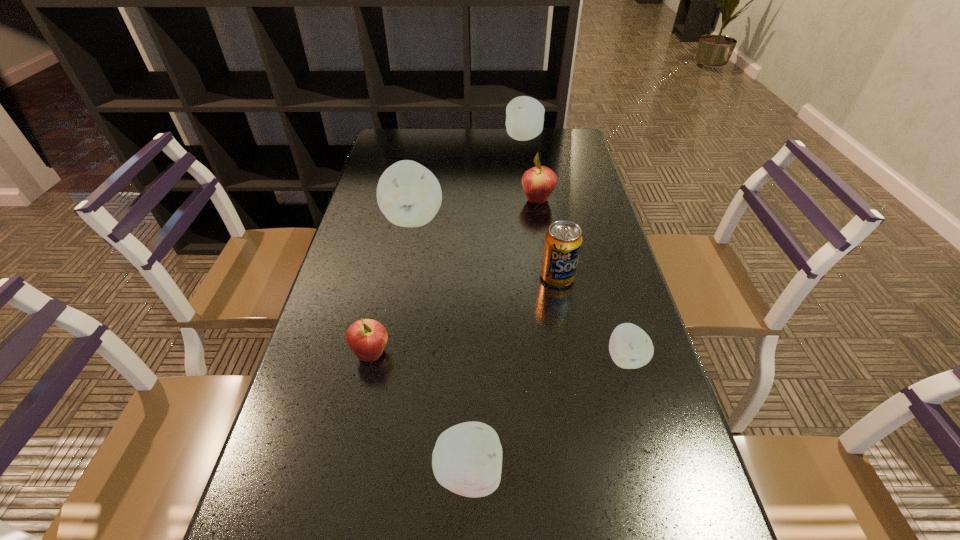
You are a GUI agent. You are given a task and a screenshot of the screen. Output one action in this format:
    pyautogui.click(x=<x>, y=<y>)
    Task: Click on the nearest apple
    This screenshot has height=540, width=960.
    Given the screenshot: What is the action you would take?
    click(467, 458)

Locate an element on the screen. the shortest apple is located at coordinates (630, 347).

This screenshot has width=960, height=540. In order to click on the rightmost white apple in this screenshot , I will do `click(630, 347)`.

What are the coordinates of `free space located 0.260m on the front of the biggest white apple` in the screenshot? It's located at (398, 306).

This screenshot has height=540, width=960. In order to click on vacant region located on the front of the farthest apple in this screenshot , I will do `click(534, 204)`.

Where is `vacant space situated 0.330m on the back of the farther red apple`? The height and width of the screenshot is (540, 960). vacant space situated 0.330m on the back of the farther red apple is located at coordinates (528, 142).

Locate an element on the screen. This screenshot has height=540, width=960. free region located 0.290m on the front of the soda can is located at coordinates (579, 393).

What are the coordinates of `free space located on the back of the nearer red apple` in the screenshot? It's located at (379, 319).

You are a GUI agent. You are given a task and a screenshot of the screen. Output one action in this format:
    pyautogui.click(x=<x>, y=<y>)
    Task: Click on the vacant space located 0.200m on the right of the nearest object
    This screenshot has width=960, height=540.
    Given the screenshot: What is the action you would take?
    pyautogui.click(x=616, y=474)

Find the location of `vacant space located 0.250m on the front of the third farthest white apple`. vacant space located 0.250m on the front of the third farthest white apple is located at coordinates (667, 504).